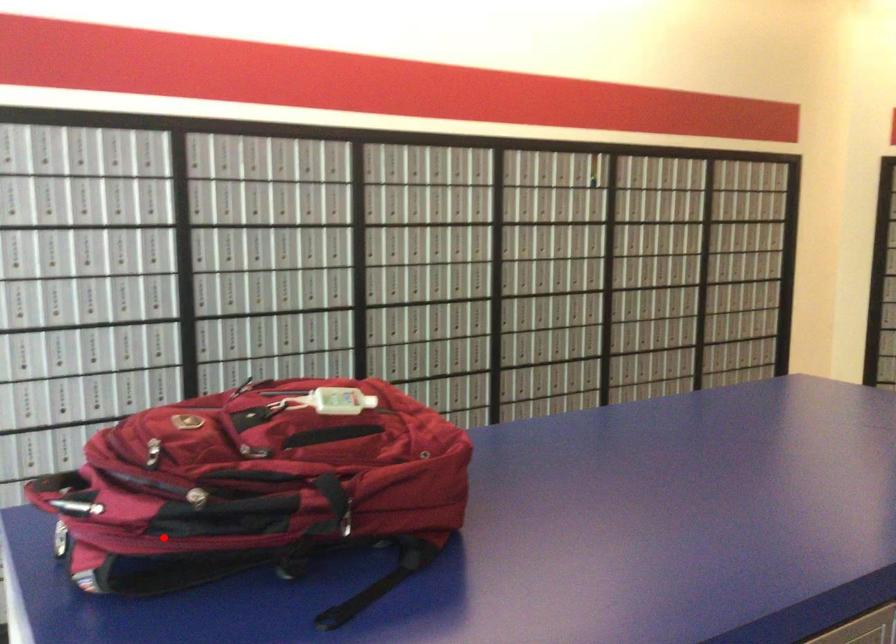
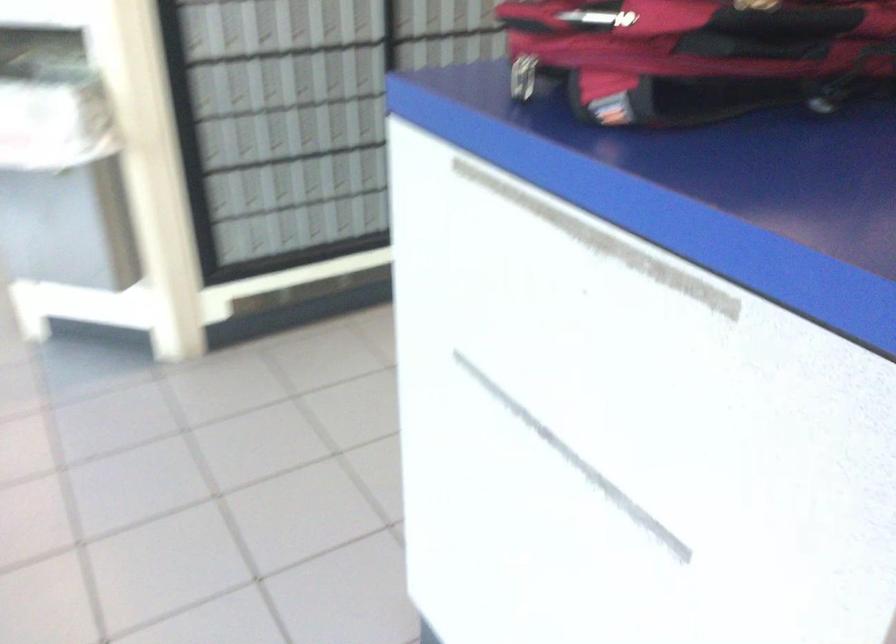
Question: A red point is marked in image1. In image2, is the corresponding 3D point closer to the camera or farther? Reply with the corresponding letter.

Choices:
 (A) The corresponding 3D point is closer.
 (B) The corresponding 3D point is farther.

Answer: (A)